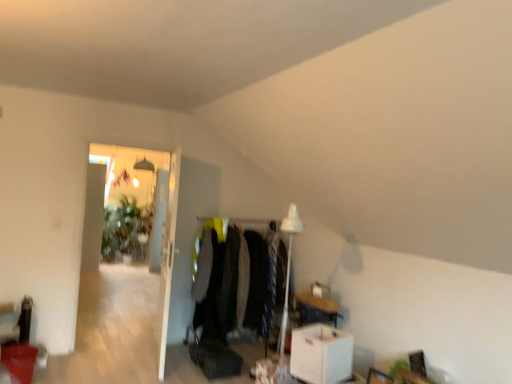
Identify the location of free space in front of transparent glass door at left. click(110, 354).